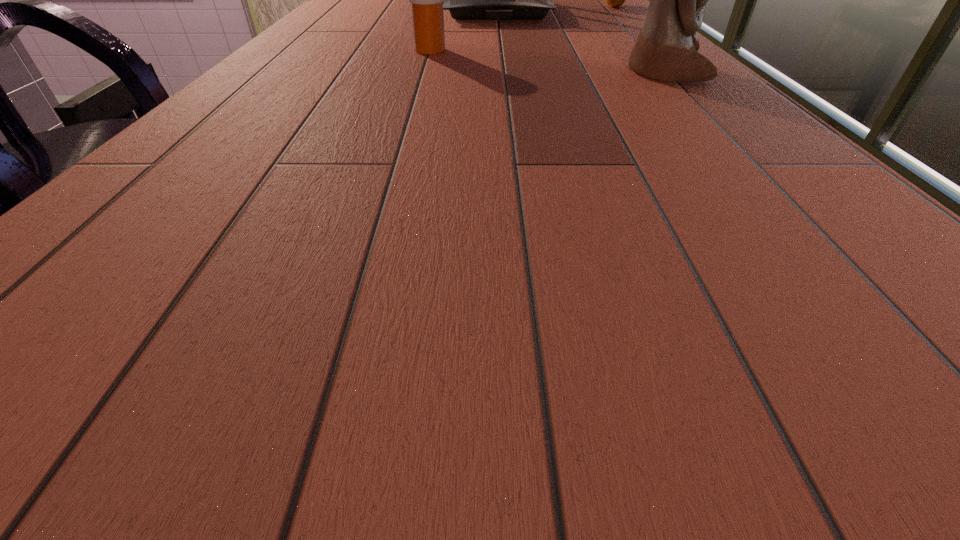
Where is `vacant space located 0.200m on the front-facing side of the router`? The image size is (960, 540). vacant space located 0.200m on the front-facing side of the router is located at coordinates (503, 43).

Where is `vacant space located 0.370m on the front-facing side of the router`? This screenshot has height=540, width=960. vacant space located 0.370m on the front-facing side of the router is located at coordinates (507, 66).

Locate an element on the screen. This screenshot has width=960, height=540. vacant area located on the front-facing side of the router is located at coordinates (504, 47).

This screenshot has width=960, height=540. What are the coordinates of `lemon that is at the far edge` in the screenshot? It's located at (614, 0).

Find the location of a particular element. The image size is (960, 540). router positioned at the far edge is located at coordinates (466, 0).

At what (x,y) coordinates should I click in order to perform the action: click on figurine at the right edge. Please return your answer as a coordinate pair (x, y). Looking at the image, I should click on (666, 49).

Image resolution: width=960 pixels, height=540 pixels. Identify the location of lemon positioned at the right edge. (614, 0).

In order to click on object that is at the far right corner in this screenshot , I will do `click(614, 0)`.

Locate an element on the screen. The height and width of the screenshot is (540, 960). blank space at the far edge of the desktop is located at coordinates (565, 3).

The width and height of the screenshot is (960, 540). I want to click on free space at the near edge, so click(221, 241).